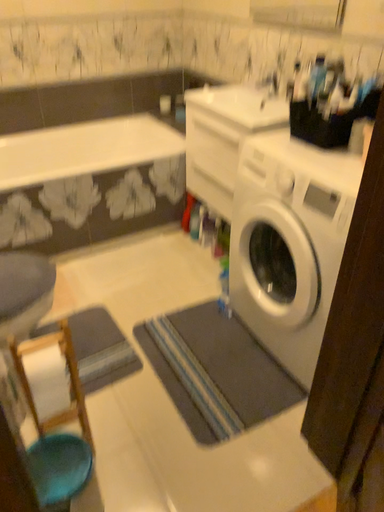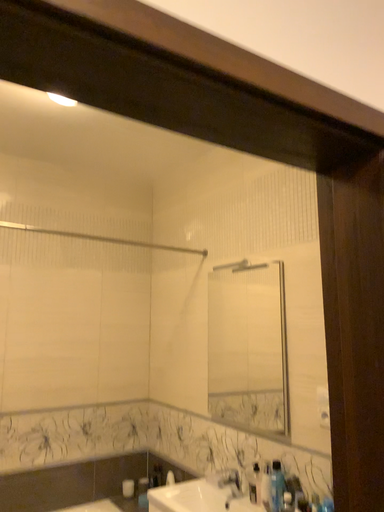
Question: How did the camera likely rotate when shooting the video?

Choices:
 (A) rotated downward
 (B) rotated upward

Answer: (B)